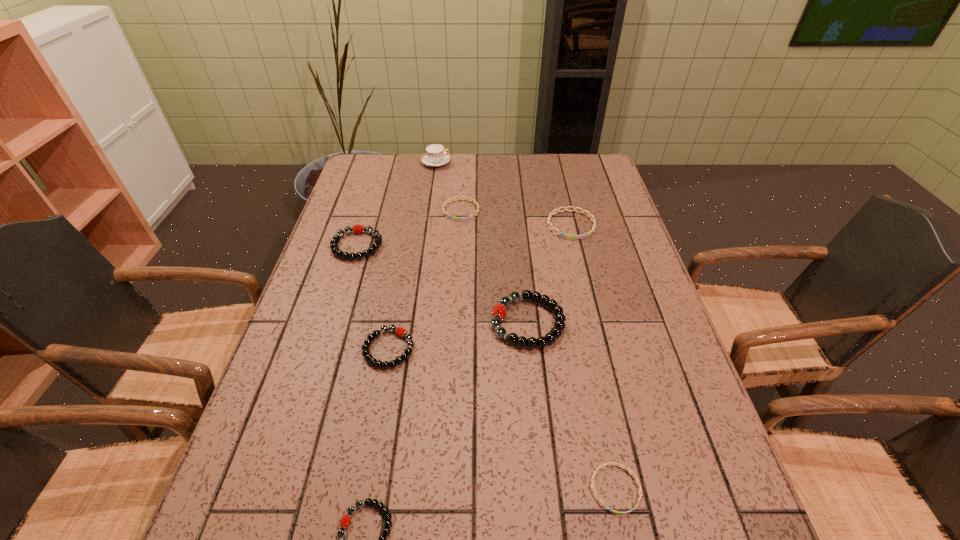
At what (x,y) coordinates should I click in order to perform the action: click on blank region between the nearest blue bracelet and the biggest black bracelet. Please return your answer as a coordinate pair (x, y). Looking at the image, I should click on (571, 406).

At what (x,y) coordinates should I click in order to perform the action: click on empty space that is in between the biggest black bracelet and the smallest blue bracelet. Please return your answer as a coordinate pair (x, y). The image size is (960, 540). Looking at the image, I should click on (571, 406).

Where is `empty location between the shortest bracelet and the third biggest black bracelet`? This screenshot has width=960, height=540. empty location between the shortest bracelet and the third biggest black bracelet is located at coordinates (502, 418).

The width and height of the screenshot is (960, 540). Identify the location of object that is the fifth closest to the biggest blue bracelet. (358, 229).

Where is `object that can be found as the third closest to the shortest bracelet`? The height and width of the screenshot is (540, 960). object that can be found as the third closest to the shortest bracelet is located at coordinates (401, 332).

At what (x,y) coordinates should I click in order to perform the action: click on bracelet that is the fourth closest to the nearest blue bracelet. Please return your answer as a coordinate pair (x, y). This screenshot has height=540, width=960. Looking at the image, I should click on (568, 236).

Find the location of a particular element. Image resolution: width=960 pixels, height=540 pixels. bracelet that is the sixth closest to the second biggest blue bracelet is located at coordinates (368, 502).

Where is `black bracelet that is the second closest to the nearest blue bracelet`? black bracelet that is the second closest to the nearest blue bracelet is located at coordinates (368, 502).

Select which black bracelet is the second closest to the biggest blue bracelet. Please provide its 2D coordinates. Your answer should be formatted as a tuple, i.e. [(x, y)], where the tuple contains the x and y coordinates of a point satisfying the conditions above.

[(401, 332)]

This screenshot has height=540, width=960. I want to click on blue bracelet object that ranks as the second closest to the teacup, so click(568, 236).